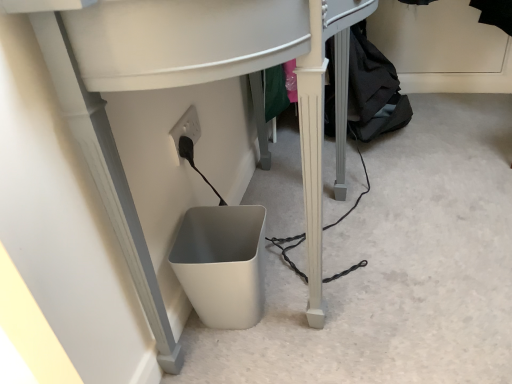
Find the location of a particular element. Image resolution: width=512 pixels, height=384 pixels. spots to the right of white plastic computer desk at lower center is located at coordinates (439, 211).